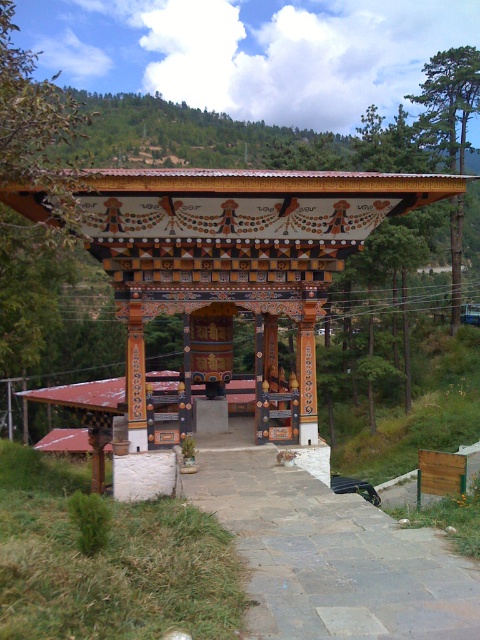
Can you confirm if painted wood gazebo at center is thinner than gray stone path at center?

Incorrect, painted wood gazebo at center's width is not less than gray stone path at center's.

Who is lower down, painted wood gazebo at center or gray stone path at center?

gray stone path at center

Is point (131, 323) closer to viewer compared to point (296, 563)?

No.

Where is `painted wood gazebo at center`? This screenshot has height=640, width=480. painted wood gazebo at center is located at coordinates (236, 264).